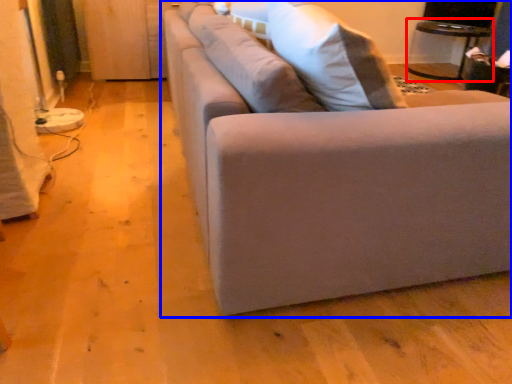
Question: Which object appears closest to the camera in this image, table (highlighted by a red box) or studio couch (highlighted by a blue box)?

Choices:
 (A) table
 (B) studio couch

Answer: (B)